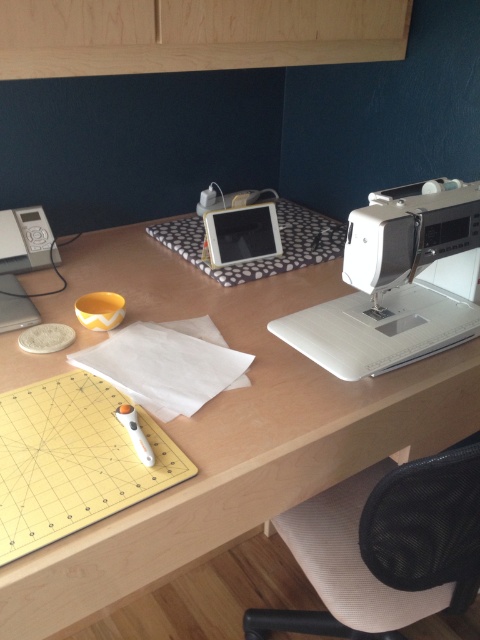
You are setting up a new workspace and need to place a laptop on the wooden computer desk at center and a sewing kit on the white plastic sewing machine at right. Based on their positions, which object is closer to you when standing in front of the desk?

The wooden computer desk at center is closer to you because it is positioned in front of the white plastic sewing machine at right, making it the first object you encounter when standing in front of the desk.

You are a person with a height of 5 feet 6 inches. You are standing in front of the wooden computer desk at center. Can you comfortably work on the desk without needing to bend down or stretch too much?

The wooden computer desk at center is 25.06 inches from camera. Since the desk is at a standard height for a person of 5 feet 6 inches, you can comfortably work on it without bending down or stretching too much.

You need to place a new monitor on your desk but want to ensure there is enough space. Given that the wooden computer desk at center is larger than the white plastic sewing machine at right, can you fit the monitor next to the sewing machine?

The wooden computer desk at center has a larger size compared to the white plastic sewing machine at right, so there should be sufficient space to place the monitor next to the sewing machine.